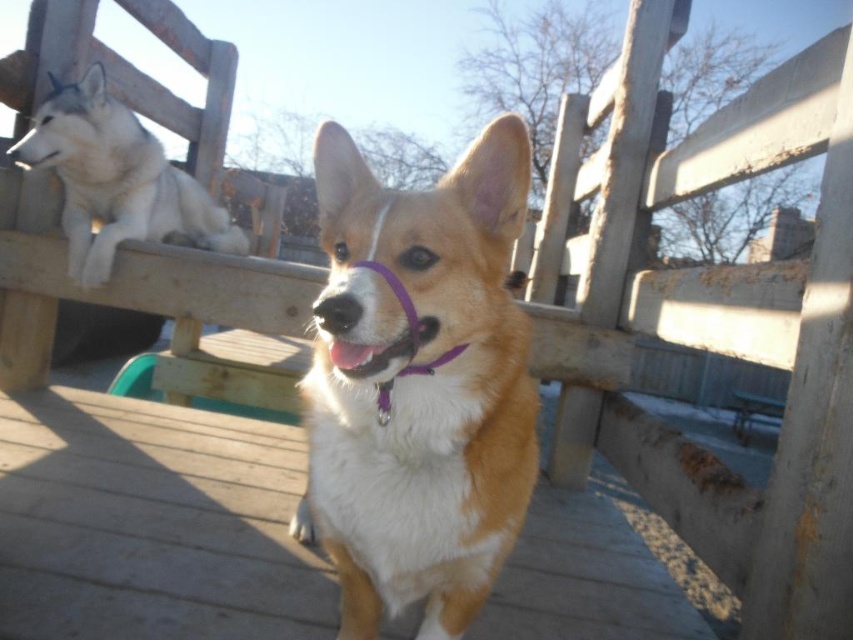
Question: Which point appears farthest from the camera in this image?

Choices:
 (A) (33, 124)
 (B) (428, 387)
 (C) (155, 488)

Answer: (A)

Question: Is golden fur dog at center positioned at the back of white fur dog at upper left?

Choices:
 (A) yes
 (B) no

Answer: (B)

Question: Is golden fur dog at center to the right of white fur dog at upper left from the viewer's perspective?

Choices:
 (A) no
 (B) yes

Answer: (B)

Question: Which is farther from the white fur dog at upper left?

Choices:
 (A) wooden deck at center
 (B) golden fur dog at center

Answer: (B)

Question: Can you confirm if wooden deck at center is thinner than white fur dog at upper left?

Choices:
 (A) no
 (B) yes

Answer: (A)

Question: Among these objects, which one is farthest from the camera?

Choices:
 (A) wooden deck at center
 (B) golden fur dog at center

Answer: (A)